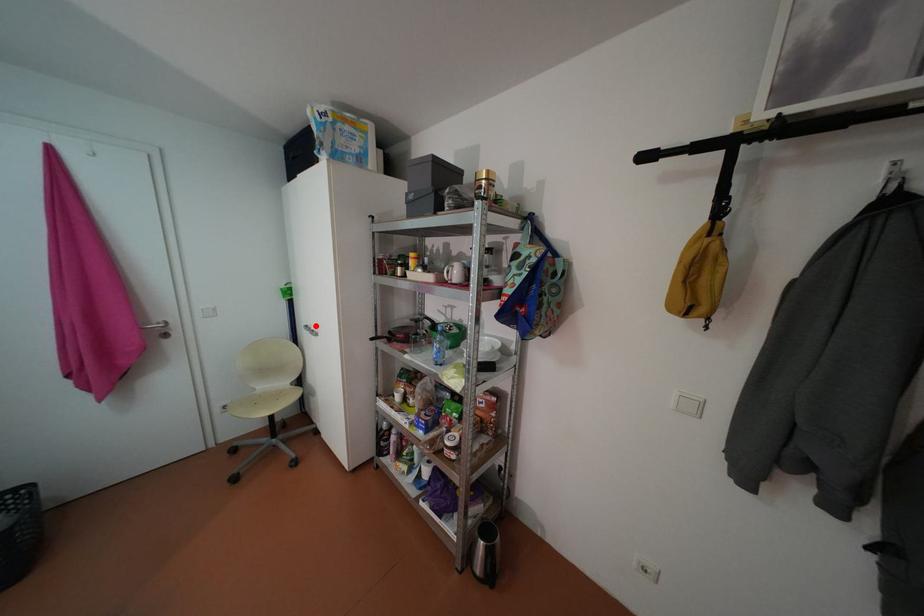
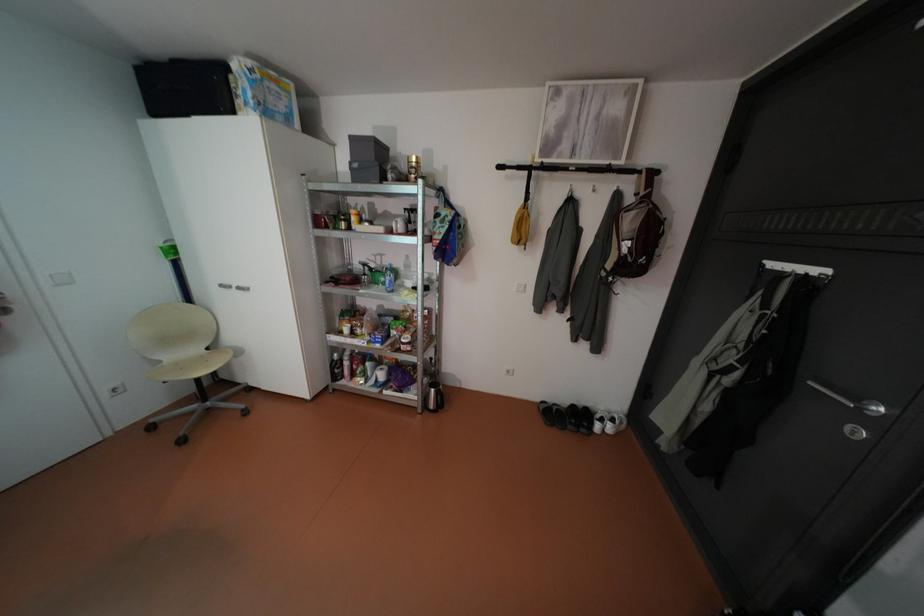
Find the pixel in the second image that matches the highlighted location in the first image.

(232, 285)